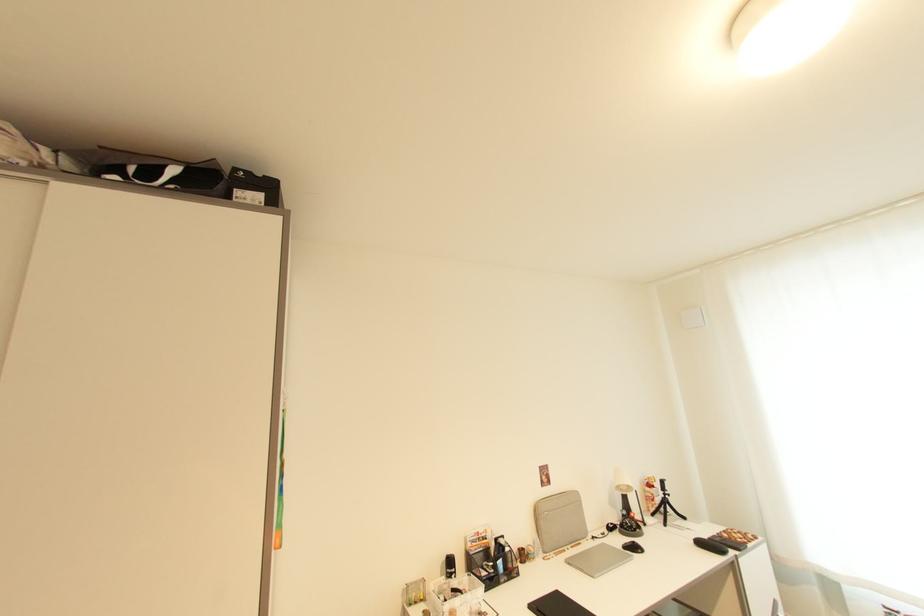
Where would you lift the black spray can? Please return your answer as a coordinate pair (x, y).

(448, 565)